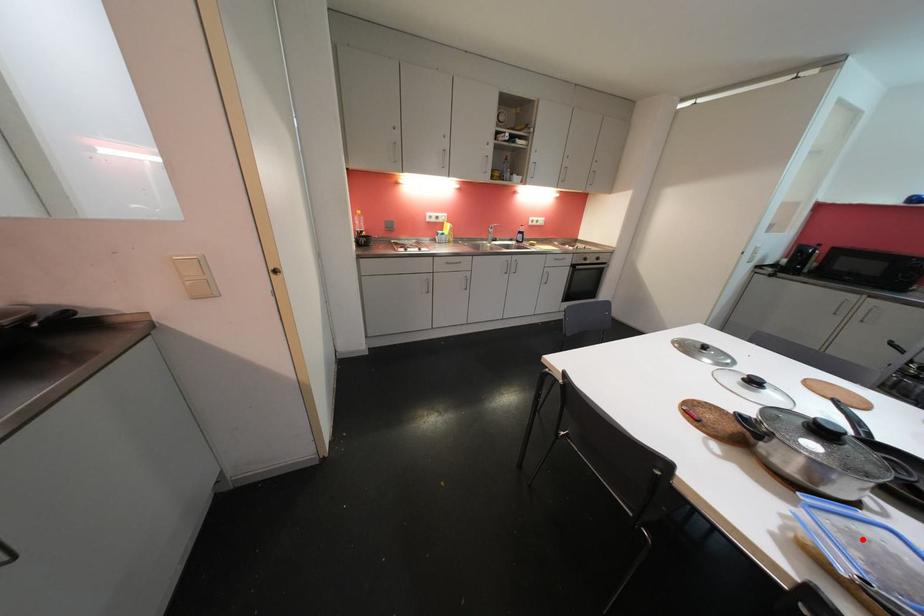
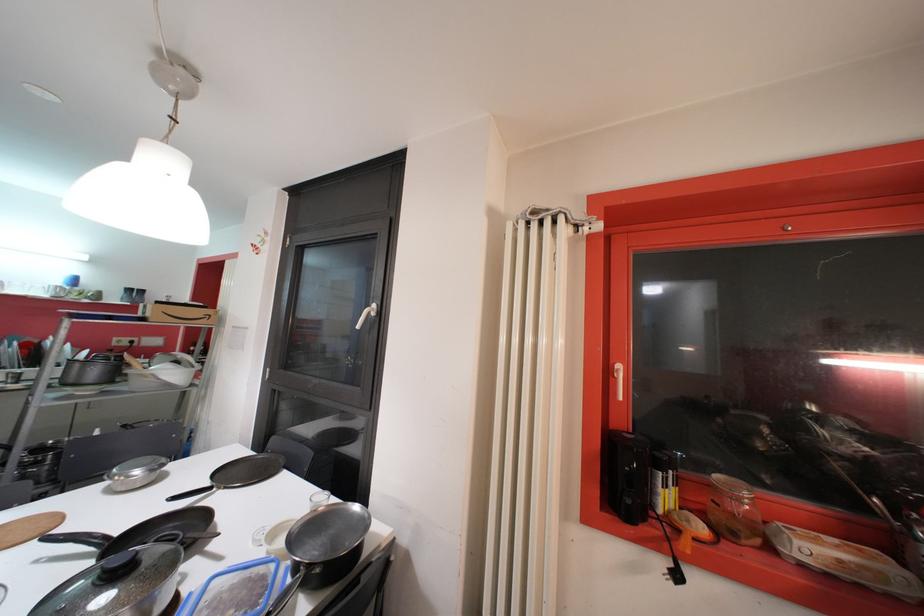
Question: I am providing you with two images of the same scene from different viewpoints. In image1, a red point is highlighted. Considering the same 3D point in image2, which of the following is correct?

Choices:
 (A) It is closer
 (B) It is farther

Answer: (A)